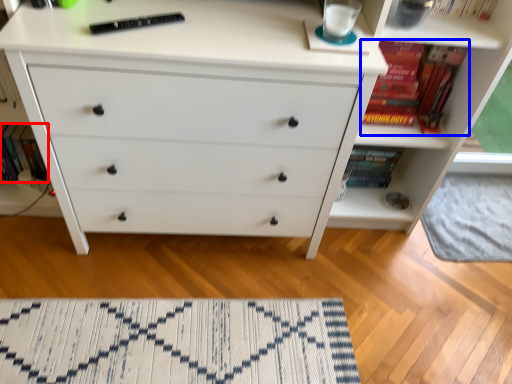
Question: Which of the following is the closest to the observer, book (highlighted by a red box) or book (highlighted by a blue box)?

Choices:
 (A) book
 (B) book

Answer: (B)